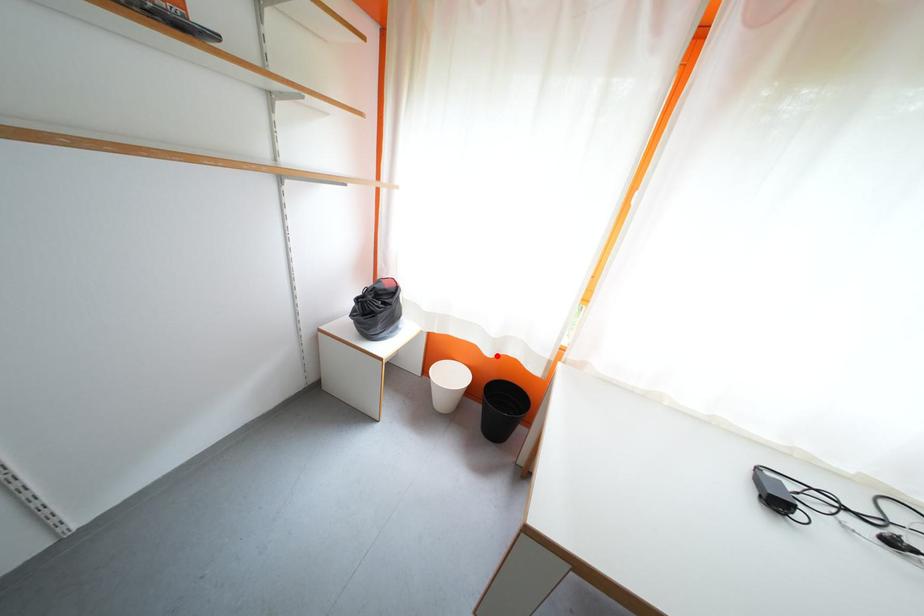
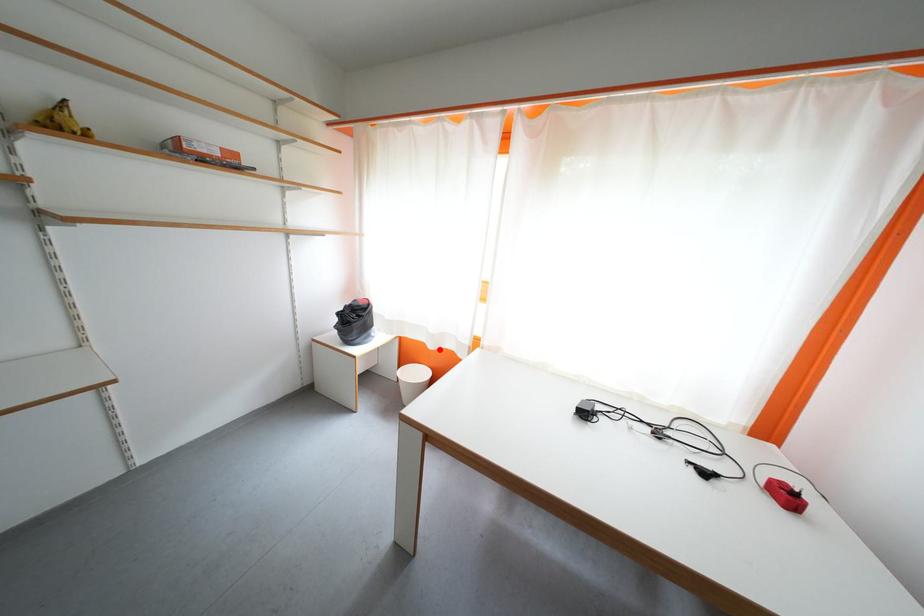
I am providing you with two images of the same scene from different viewpoints. A red point is marked on the first image and another point is marked on the second image. Is the red point in image1 aligned with the point shown in image2?

Yes